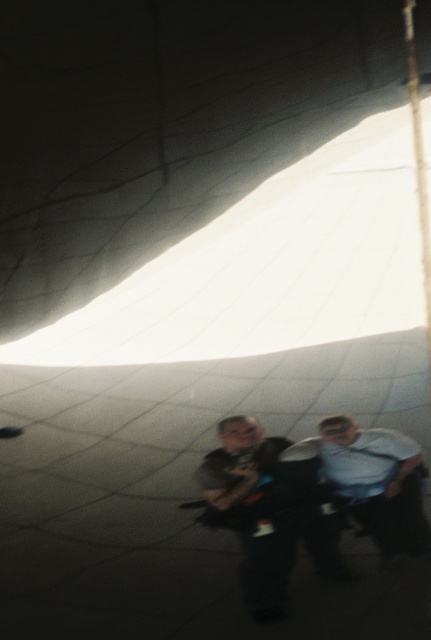
Question: Among these objects, which one is farthest from the camera?

Choices:
 (A) light blue shirt at center
 (B) matte black backpack at center

Answer: (A)

Question: Does matte black backpack at center have a greater width compared to light blue shirt at center?

Choices:
 (A) no
 (B) yes

Answer: (B)

Question: Can you confirm if matte black backpack at center is positioned to the left of light blue shirt at center?

Choices:
 (A) yes
 (B) no

Answer: (A)

Question: Can you confirm if matte black backpack at center is positioned to the left of light blue shirt at center?

Choices:
 (A) no
 (B) yes

Answer: (B)